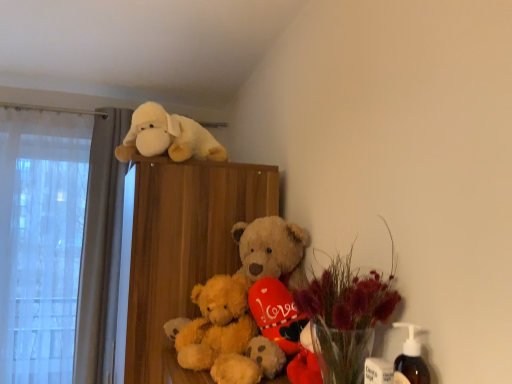
Question: Could you tell me if fluffy white plush dog at upper center is turned towards fluffy golden teddy bear at center?

Choices:
 (A) yes
 (B) no

Answer: (B)

Question: From a real-world perspective, is fluffy white plush dog at upper center located beneath fluffy golden teddy bear at center?

Choices:
 (A) yes
 (B) no

Answer: (B)

Question: From a real-world perspective, is fluffy white plush dog at upper center on fluffy golden teddy bear at center?

Choices:
 (A) yes
 (B) no

Answer: (A)

Question: Is fluffy white plush dog at upper center bigger than fluffy golden teddy bear at center?

Choices:
 (A) yes
 (B) no

Answer: (A)

Question: Does fluffy white plush dog at upper center come in front of fluffy golden teddy bear at center?

Choices:
 (A) yes
 (B) no

Answer: (B)

Question: Considering the positions of translucent glass vase at center, the 2th floral arrangement in the front-to-back sequence, and fluffy white plush dog at upper center in the image, is translucent glass vase at center, the 2th floral arrangement in the front-to-back sequence, wider or thinner than fluffy white plush dog at upper center?

Choices:
 (A) wide
 (B) thin

Answer: (B)

Question: Do you think translucent glass vase at center, the 2th floral arrangement in the front-to-back sequence, is within fluffy white plush dog at upper center, or outside of it?

Choices:
 (A) outside
 (B) inside

Answer: (A)

Question: Is translucent glass vase at center, the 2th floral arrangement in the front-to-back sequence, taller or shorter than fluffy white plush dog at upper center?

Choices:
 (A) tall
 (B) short

Answer: (A)

Question: Is translucent glass vase at center, which appears as the first floral arrangement when viewed from the back, to the left or to the right of fluffy white plush dog at upper center in the image?

Choices:
 (A) right
 (B) left

Answer: (A)

Question: In terms of height, does fluffy white plush dog at upper center look taller or shorter compared to fluffy golden teddy bear at center?

Choices:
 (A) tall
 (B) short

Answer: (B)

Question: Based on their positions, is fluffy white plush dog at upper center located to the left or right of fluffy golden teddy bear at center?

Choices:
 (A) right
 (B) left

Answer: (B)

Question: Based on their sizes in the image, would you say fluffy white plush dog at upper center is bigger or smaller than fluffy golden teddy bear at center?

Choices:
 (A) big
 (B) small

Answer: (A)

Question: From a real-world perspective, relative to fluffy golden teddy bear at center, is fluffy white plush dog at upper center vertically above or below?

Choices:
 (A) above
 (B) below

Answer: (A)

Question: Considering the relative positions of fluffy golden teddy bear at center and translucent glass vase at center, which appears as the first floral arrangement when viewed from the back, in the image provided, is fluffy golden teddy bear at center to the left or to the right of translucent glass vase at center, which appears as the first floral arrangement when viewed from the back,?

Choices:
 (A) left
 (B) right

Answer: (A)

Question: From a real-world perspective, is fluffy golden teddy bear at center positioned above or below translucent glass vase at center, the 2th floral arrangement in the front-to-back sequence?

Choices:
 (A) below
 (B) above

Answer: (A)